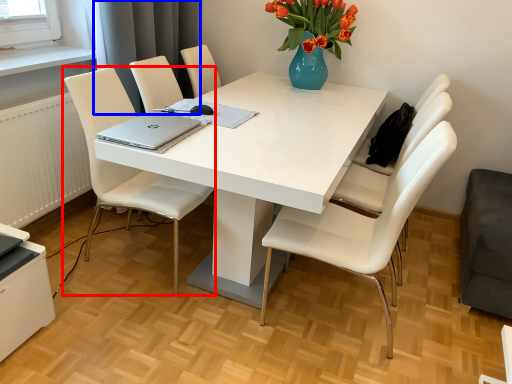
Question: Which object appears closest to the camera in this image, chair (highlighted by a red box) or curtain (highlighted by a blue box)?

Choices:
 (A) chair
 (B) curtain

Answer: (A)